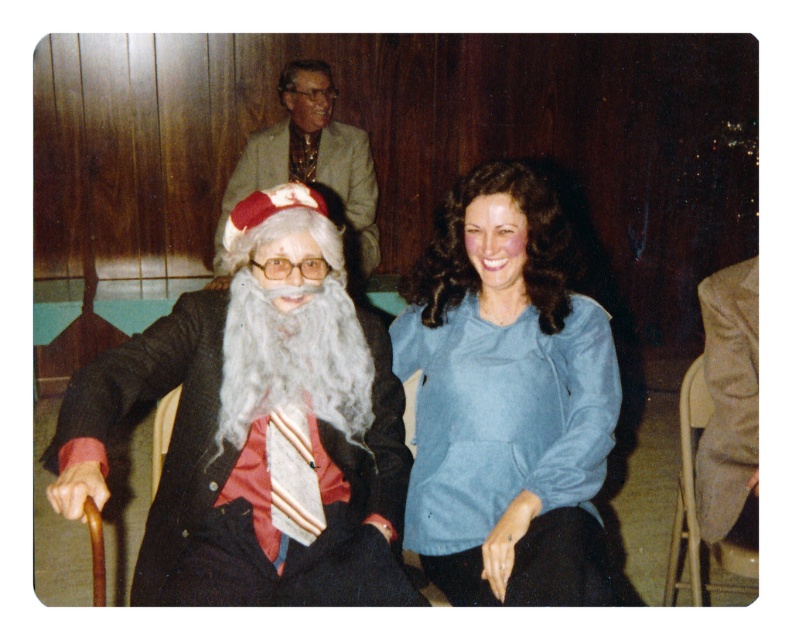
Question: Which of the following is the closest to the observer?

Choices:
 (A) light brown textured suit at upper center
 (B) gray fuzzy beard at center

Answer: (B)

Question: Can you confirm if matte black santa at left is wider than gray fuzzy beard at center?

Choices:
 (A) yes
 (B) no

Answer: (A)

Question: Which object is farther from the camera taking this photo?

Choices:
 (A) gray fuzzy beard at center
 (B) metallic gray chair at lower right
 (C) blue velvety blouse at center
 (D) matte black santa at left

Answer: (B)

Question: Does gray fuzzy beard at center have a lesser width compared to light brown textured suit at upper center?

Choices:
 (A) yes
 (B) no

Answer: (A)

Question: Is the position of matte black santa at left less distant than that of light brown textured suit at upper center?

Choices:
 (A) yes
 (B) no

Answer: (A)

Question: Which of the following is the farthest from the observer?

Choices:
 (A) (276, 157)
 (B) (386, 403)
 (C) (356, 317)
 (D) (674, 554)

Answer: (A)